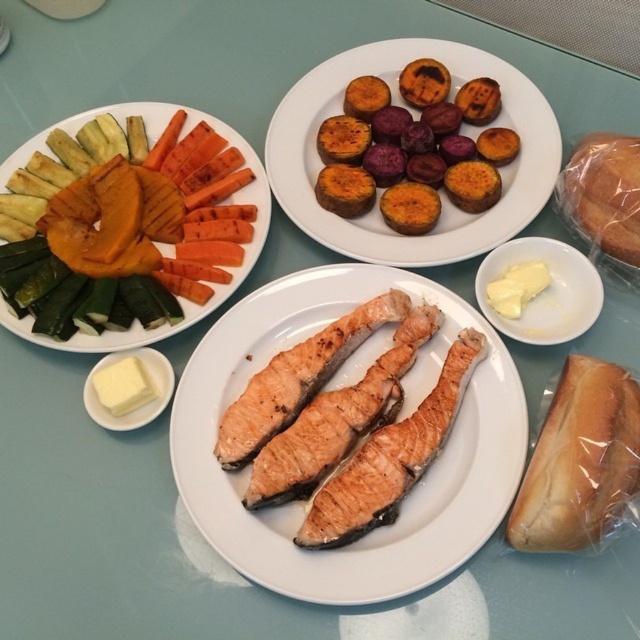
You are a customer at a restaurant and you want to point to the grilled vegetables at upper left. Can you reach the point at coordinates (148, 145)?

Yes, the point at coordinates (148, 145) is on the grilled vegetables at upper left, so you can reach it.